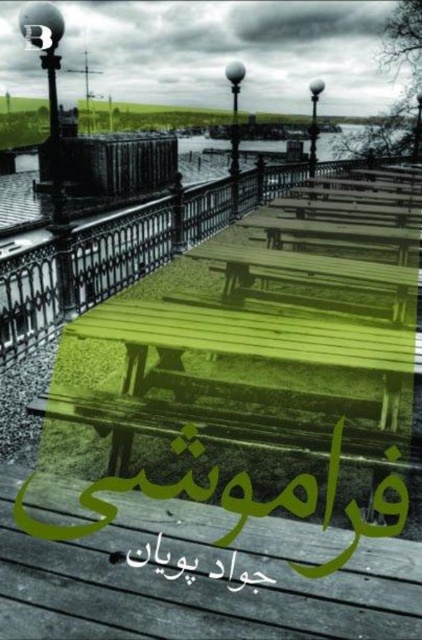
You are a photographer setting up a shot of the waterfront promenade. You want to ensure that the polished metal lamp post at upper left is visible above the black paper at center. Based on the scene, will the lamp post be visible above the paper?

The polished metal lamp post at upper left is positioned over black paper at center, so yes, the lamp post will be visible above the paper.